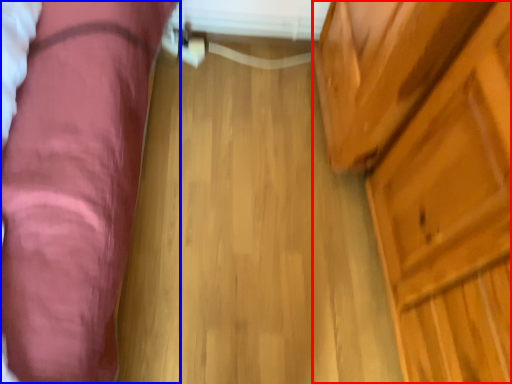
Question: Among these objects, which one is nearest to the camera, dresser (highlighted by a red box) or furniture (highlighted by a blue box)?

Choices:
 (A) dresser
 (B) furniture

Answer: (A)